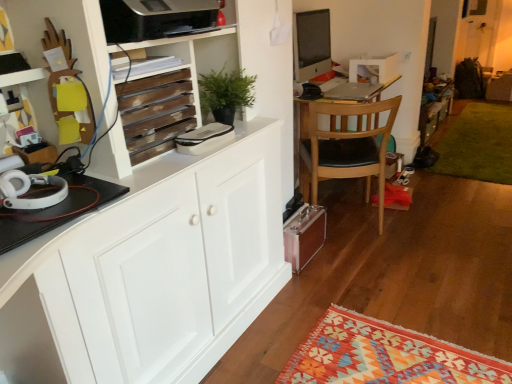
Locate an element on the screen. vacant space to the right of light brown wood chair at center is located at coordinates tap(423, 222).